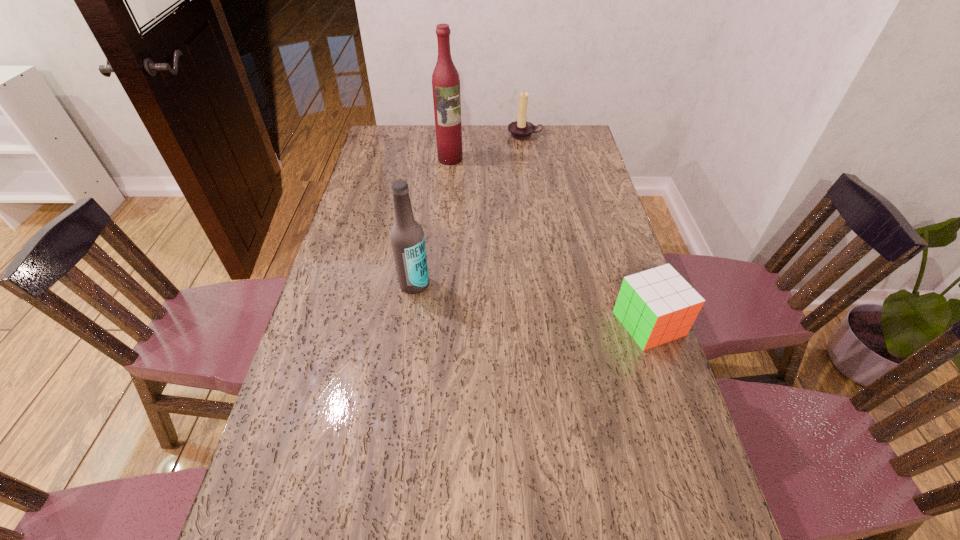
You are a GUI agent. You are given a task and a screenshot of the screen. Output one action in this format:
    pyautogui.click(x=<x>, y=<y>)
    Task: Click on the free space located 0.110m on the wick of the candle holder
    
    Given the screenshot: What is the action you would take?
    pyautogui.click(x=525, y=156)

Locate an element on the screen. Image resolution: width=960 pixels, height=540 pixels. vacant space located on the wick of the candle holder is located at coordinates (525, 183).

Where is `vacant space situated 0.390m on the wick of the candle holder`? This screenshot has height=540, width=960. vacant space situated 0.390m on the wick of the candle holder is located at coordinates (525, 198).

I want to click on blank space located on the label of the third nearest object, so click(459, 172).

Locate an element on the screen. free location located 0.400m on the label of the third nearest object is located at coordinates (495, 226).

Find the location of a particular element. The width and height of the screenshot is (960, 540). vacant position located 0.080m on the label of the third nearest object is located at coordinates (462, 176).

At what (x,y) coordinates should I click in order to perform the action: click on candle holder that is at the far edge. Please return your answer as a coordinate pair (x, y). This screenshot has height=540, width=960. Looking at the image, I should click on (521, 129).

This screenshot has width=960, height=540. In order to click on liquor positioned at the far edge in this screenshot , I will do `click(445, 79)`.

At what (x,y) coordinates should I click in order to perform the action: click on object that is at the right edge. Please return your answer as a coordinate pair (x, y). Looking at the image, I should click on (656, 306).

In the image, there is a desktop. At what (x,y) coordinates should I click in order to perform the action: click on free space at the far edge. Please return your answer as a coordinate pair (x, y). The width and height of the screenshot is (960, 540). Looking at the image, I should click on (520, 141).